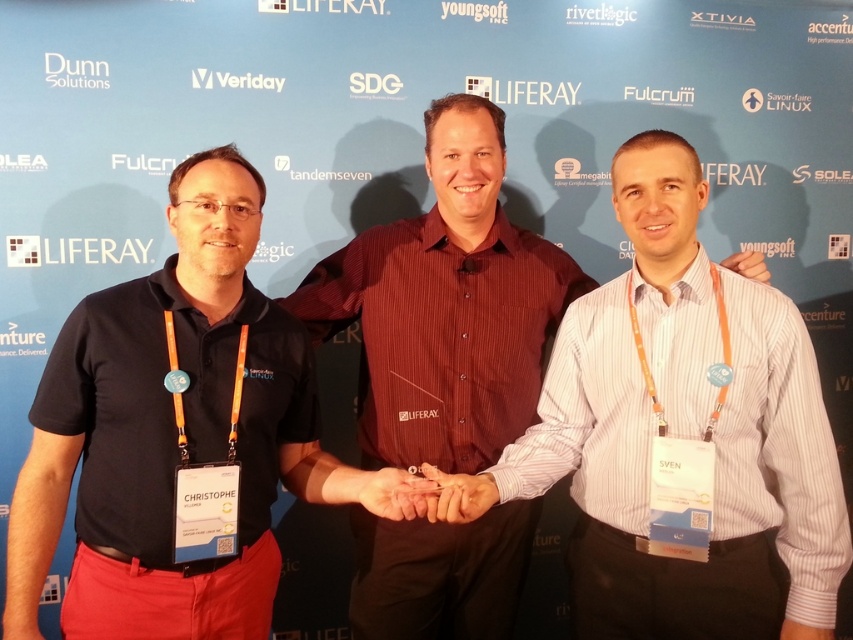
In the scene shown: Please look at the three people in the image. The point at coordinate (172, 433) is marked. Which person is closest to this point? The individuals are wearing a dark polo shirt and red trousers, a maroon button up shirt and black trousers, and a light long sleeved striped shirt and dark trousers respectively.

The point at coordinate (172, 433) marks the black shirt at center, so the middle individual wearing a maroon button up shirt and black trousers is closest to this point.

You are organizing a team photo and need to arrange the black shirt at center and the matte red shirt at center in a row such that the thinner one is on the left. Based on the scene description, how should you position them?

The black shirt at center is thinner than the matte red shirt at center, so you should place the black shirt at center on the left and the matte red shirt at center on the right.

You are standing in front of a corporate backdrop and see two people in front of you. One is wearing a black shirt at center and the other a matte red shirt at center. Which shirt is nearer to you?

The black shirt at center is closer to the viewer than the matte red shirt at center.